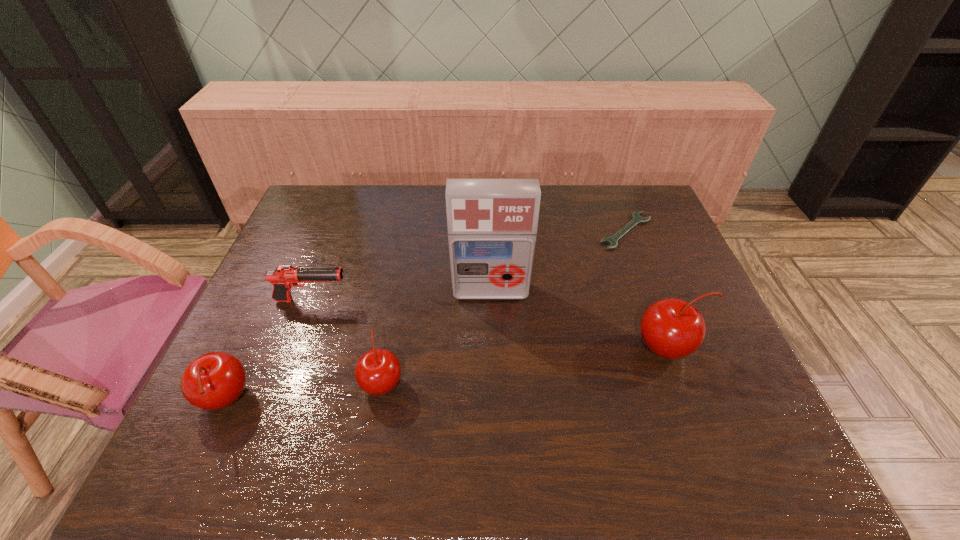
Locate an element on the screen. The image size is (960, 540). the fourth shortest object is located at coordinates (215, 380).

Locate an element on the screen. Image resolution: width=960 pixels, height=540 pixels. the second tallest cherry is located at coordinates (215, 380).

Identify the location of the third object from left to right. This screenshot has width=960, height=540. (377, 372).

You are a GUI agent. You are given a task and a screenshot of the screen. Output one action in this format:
    pyautogui.click(x=<x>, y=<y>)
    Task: Click on the second cherry from right to left
    
    Given the screenshot: What is the action you would take?
    pyautogui.click(x=377, y=372)

Find the location of a particular element. The width and height of the screenshot is (960, 540). the rightmost cherry is located at coordinates (671, 328).

This screenshot has width=960, height=540. What are the coordinates of `wrench` in the screenshot? It's located at (636, 218).

Identify the location of the shortest object. The image size is (960, 540). (636, 218).

The width and height of the screenshot is (960, 540). I want to click on gun, so click(x=284, y=277).

Where is `the third object from right to left`? the third object from right to left is located at coordinates pyautogui.click(x=492, y=224).

Where is `the first-aid kit`? This screenshot has height=540, width=960. the first-aid kit is located at coordinates (492, 224).